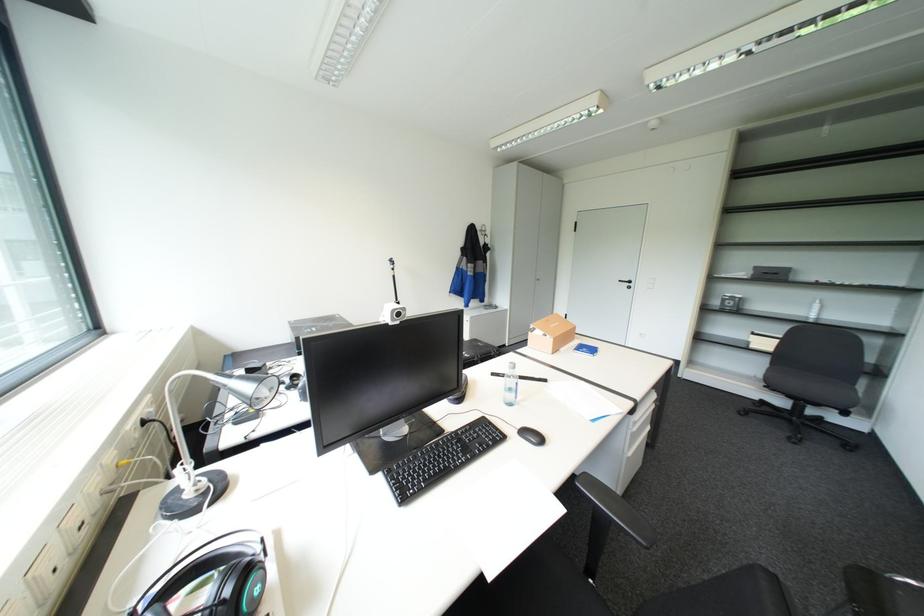
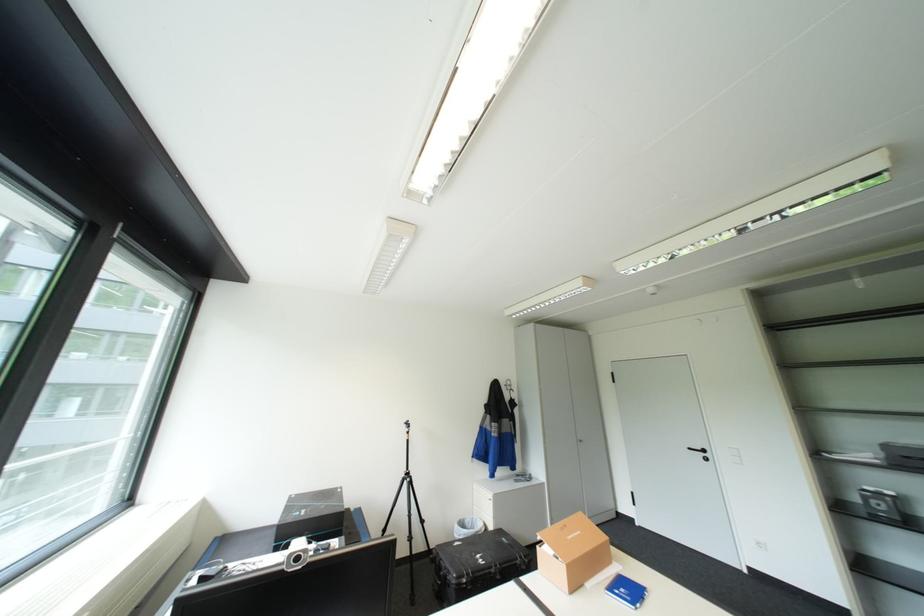
Locate, in the second image, the point that corresponds to point 488,342 in the first image.

(513, 538)